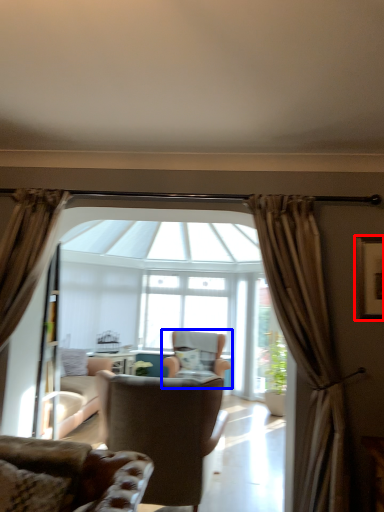
Question: Which point is further to the camera, picture frame (highlighted by a red box) or chair (highlighted by a blue box)?

Choices:
 (A) picture frame
 (B) chair

Answer: (B)